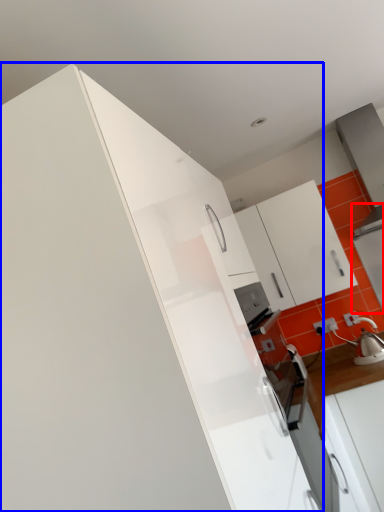
Question: Which of the following is the farthest to the observer, appliance (highlighted by a red box) or cabinetry (highlighted by a blue box)?

Choices:
 (A) appliance
 (B) cabinetry

Answer: (A)